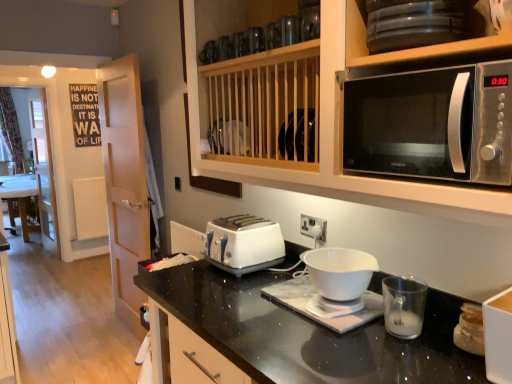
Question: From a real-world perspective, is white plastic toaster at center physically below satin silver microwave at upper right?

Choices:
 (A) no
 (B) yes

Answer: (B)

Question: Are white plastic toaster at center and satin silver microwave at upper right located far from each other?

Choices:
 (A) yes
 (B) no

Answer: (B)

Question: Is the position of white plastic toaster at center less distant than that of satin silver microwave at upper right?

Choices:
 (A) yes
 (B) no

Answer: (B)

Question: Is white plastic toaster at center shorter than satin silver microwave at upper right?

Choices:
 (A) yes
 (B) no

Answer: (A)

Question: Could you tell me if white plastic toaster at center is turned towards satin silver microwave at upper right?

Choices:
 (A) yes
 (B) no

Answer: (B)

Question: From a real-world perspective, is white plastic drawer at lower center physically located above or below white glossy table at left?

Choices:
 (A) below
 (B) above

Answer: (B)

Question: Would you say white plastic drawer at lower center is to the left or to the right of white glossy table at left in the picture?

Choices:
 (A) right
 (B) left

Answer: (A)

Question: In terms of size, does white plastic drawer at lower center appear bigger or smaller than white glossy table at left?

Choices:
 (A) small
 (B) big

Answer: (A)

Question: Is white plastic drawer at lower center situated inside white glossy table at left or outside?

Choices:
 (A) inside
 (B) outside

Answer: (B)

Question: From the image's perspective, is white plastic drawer at lower center positioned above or below white glossy bowl at center, the 2th appliance positioned from the front?

Choices:
 (A) below
 (B) above

Answer: (A)

Question: In the image, is white plastic drawer at lower center positioned in front of or behind white glossy bowl at center, the 2th appliance positioned from the front?

Choices:
 (A) front
 (B) behind

Answer: (B)

Question: Would you say white plastic drawer at lower center is inside or outside white glossy bowl at center, which is the 1th appliance in back-to-front order?

Choices:
 (A) outside
 (B) inside

Answer: (A)

Question: Considering the positions of point (174, 375) and point (263, 289), is point (174, 375) closer or farther from the camera than point (263, 289)?

Choices:
 (A) closer
 (B) farther

Answer: (B)

Question: From a real-world perspective, relative to white glossy door at left, is white plastic toaster at center vertically above or below?

Choices:
 (A) below
 (B) above

Answer: (B)

Question: Choose the correct answer: Is white plastic toaster at center inside white glossy door at left or outside it?

Choices:
 (A) inside
 (B) outside

Answer: (B)